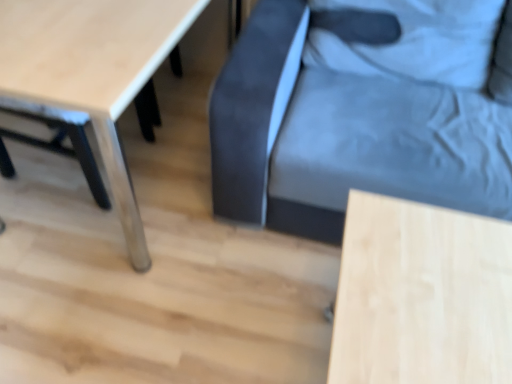
Question: Which is correct: dark blue fabric swivel chair at center is inside light wood table at lower right, acting as the second table starting from the left, or outside of it?

Choices:
 (A) outside
 (B) inside

Answer: (A)

Question: Visually, is dark blue fabric swivel chair at center positioned to the left or to the right of light wood table at lower right, the 1th table viewed from the right?

Choices:
 (A) right
 (B) left

Answer: (A)

Question: Which of these objects is positioned farthest from the dark blue fabric swivel chair at center?

Choices:
 (A) light wood table at lower left, placed as the 1th table when sorted from left to right
 (B) light wood table at lower right, the 1th table viewed from the right

Answer: (A)

Question: Considering the real-world distances, which object is farthest from the light wood table at lower left, arranged as the second table when viewed from the right?

Choices:
 (A) light wood table at lower right, acting as the second table starting from the left
 (B) dark blue fabric swivel chair at center

Answer: (A)